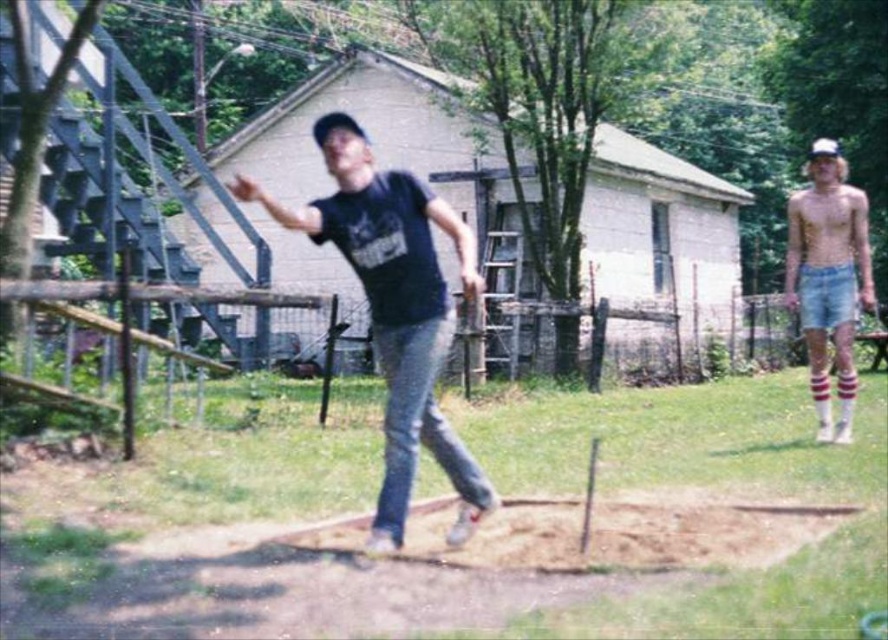
You are standing at the position of the man throwing the horseshoe. You want to walk to the point closer to you between point [429,262] and point [847,321]. Which point should you walk towards?

You should walk towards point [429,262] because it is closer to the camera than point [847,321].